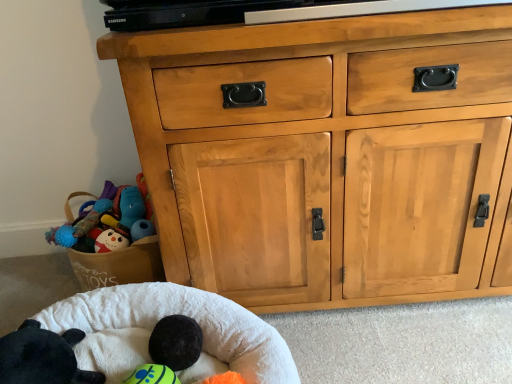
Question: From a real-world perspective, is black plush toy at lower left physically located above or below natural wood cabinet at center?

Choices:
 (A) below
 (B) above

Answer: (A)

Question: Relative to natural wood cabinet at center, is black plush toy at lower left in front or behind?

Choices:
 (A) behind
 (B) front

Answer: (B)

Question: Considering the real-world distances, which object is farthest from the white soft infant bed at lower left?

Choices:
 (A) natural wood cabinet at center
 (B) black plush toy at lower left

Answer: (A)

Question: Estimate the real-world distances between objects in this image. Which object is closer to the natural wood cabinet at center?

Choices:
 (A) white soft infant bed at lower left
 (B) black plush toy at lower left

Answer: (A)